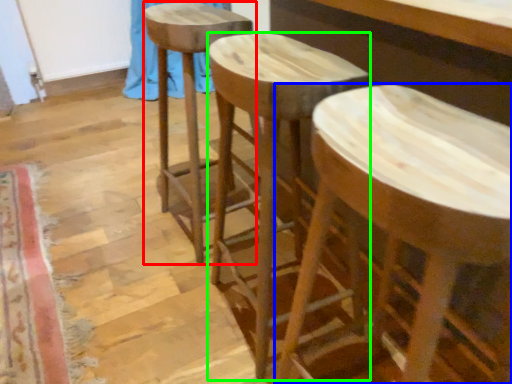
Question: Which object is positioned farthest from stool (highlighted by a red box)? Select from stool (highlighted by a blue box) and stool (highlighted by a green box).

Choices:
 (A) stool
 (B) stool

Answer: (A)